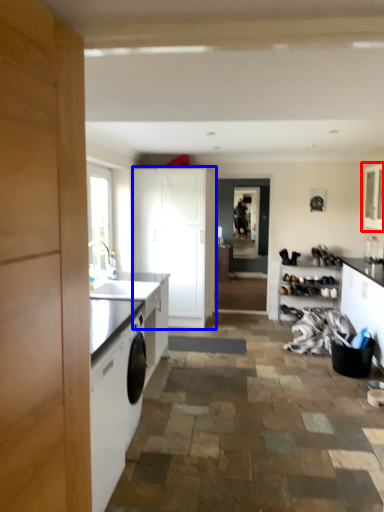
Question: Among these objects, which one is farthest to the camera, cabinetry (highlighted by a red box) or cabinetry (highlighted by a blue box)?

Choices:
 (A) cabinetry
 (B) cabinetry

Answer: (B)